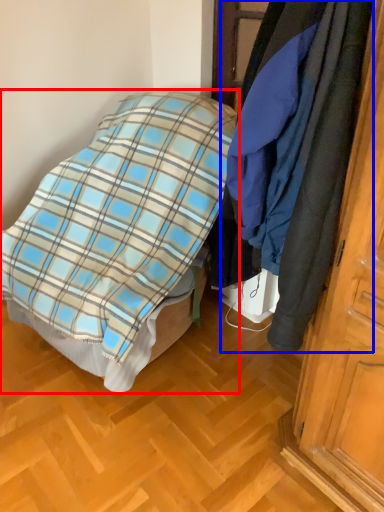
Question: Which point is further to the camera, bed (highlighted by a red box) or cloak (highlighted by a blue box)?

Choices:
 (A) bed
 (B) cloak

Answer: (A)